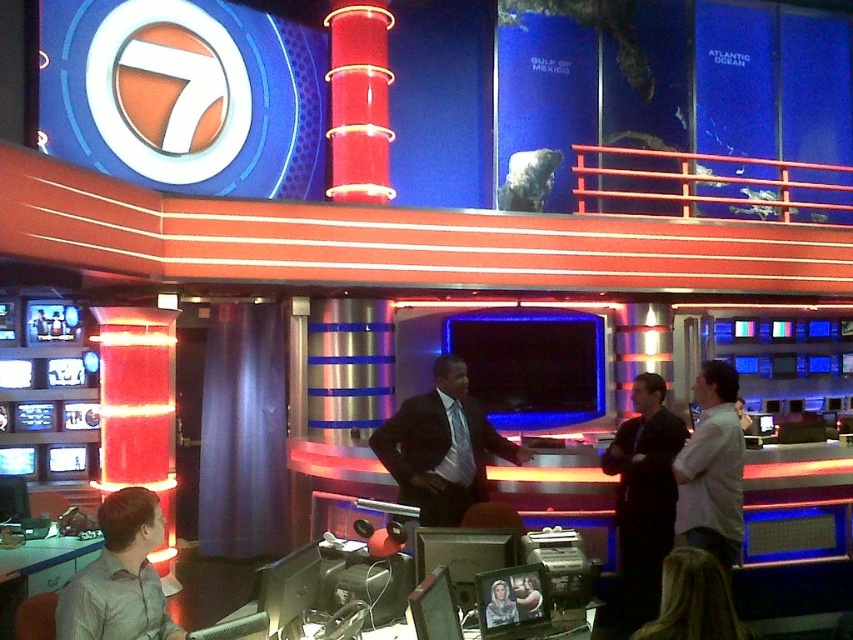
Question: Which object appears farthest from the camera in this image?

Choices:
 (A) smooth skin portrait at center
 (B) light gray shirt at lower left
 (C) matte black suit at center

Answer: (C)

Question: Does black suit at center come behind smooth skin portrait at center?

Choices:
 (A) no
 (B) yes

Answer: (B)

Question: Which of the following is the closest to the observer?

Choices:
 (A) matte black suit at center
 (B) smooth skin person at center
 (C) light gray shirt at lower left

Answer: (C)

Question: Is black suit at center thinner than smooth skin person at center?

Choices:
 (A) yes
 (B) no

Answer: (B)

Question: Which point is closer to the camera taking this photo?

Choices:
 (A) (138, 534)
 (B) (408, 442)
 (C) (503, 612)

Answer: (A)

Question: Does matte black suit at center have a larger size compared to white shirt at center?

Choices:
 (A) no
 (B) yes

Answer: (B)